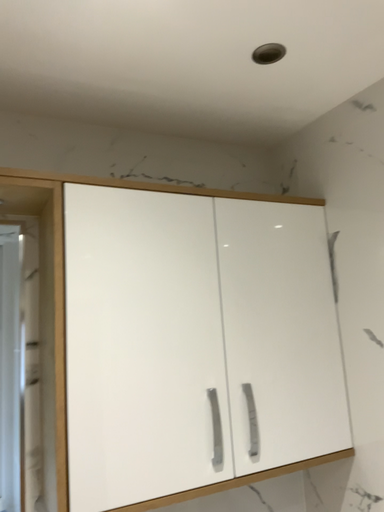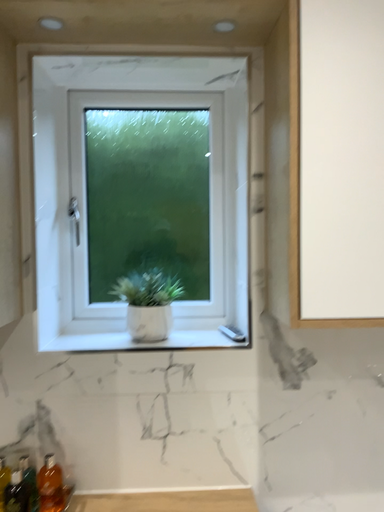
Question: How did the camera likely rotate when shooting the video?

Choices:
 (A) rotated right
 (B) rotated left

Answer: (B)